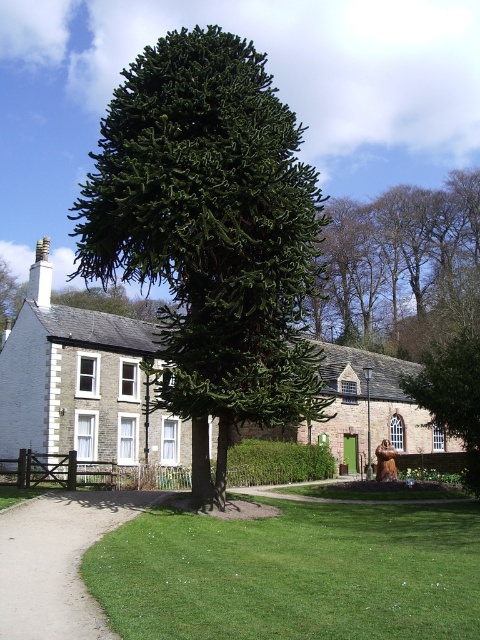
Which is more to the right, green textured tree at center or brown leafy tree at upper center?

Positioned to the right is brown leafy tree at upper center.

How much distance is there between green textured tree at center and brown leafy tree at upper center?

green textured tree at center is 107.57 feet from brown leafy tree at upper center.

Measure the distance between green textured tree at center and camera.

green textured tree at center is 60.22 feet from camera.

Identify the location of green textured tree at center. (211, 234).

Based on the photo, can you confirm if green textured tree at center is shorter than green leafy tree at center?

In fact, green textured tree at center may be taller than green leafy tree at center.

Is green textured tree at center below green leafy tree at center?

Incorrect, green textured tree at center is not positioned below green leafy tree at center.

Identify the location of green textured tree at center. (211, 234).

How much distance is there between white stone cottage at center and brown leafy tree at upper center?

white stone cottage at center and brown leafy tree at upper center are 100.07 feet apart.

Identify the location of white stone cottage at center. (82, 381).

You are a GUI agent. You are given a task and a screenshot of the screen. Output one action in this format:
    pyautogui.click(x=<x>, y=<y>)
    Task: Click on the white stone cottage at center
    The image size is (480, 640).
    Given the screenshot: What is the action you would take?
    pyautogui.click(x=82, y=381)